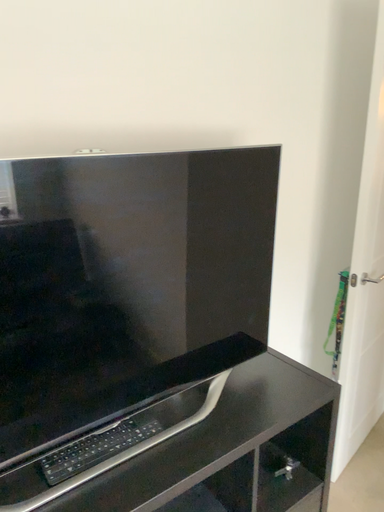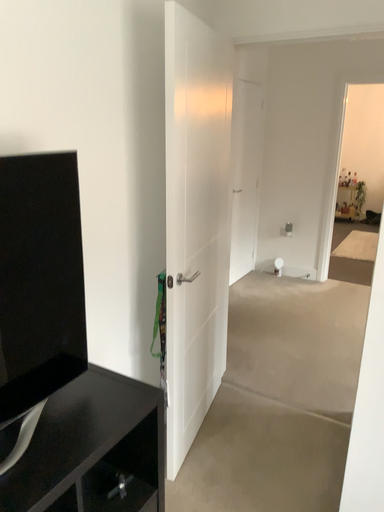
Question: How did the camera likely rotate when shooting the video?

Choices:
 (A) rotated left
 (B) rotated right

Answer: (B)